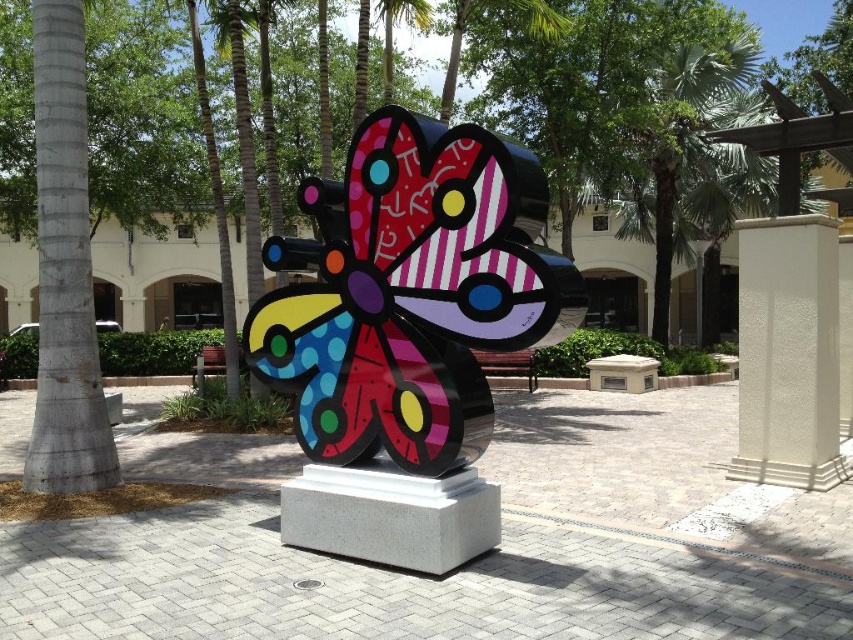
You are standing at the center of the plaza and want to place a small flower pot exactly at the point marked by the coordinates point (410, 292). Given that the metallic multicolored butterfly at center is the main sculpture here, where would this flower pot be placed relative to the sculpture?

The point (410, 292) is on the metallic multicolored butterfly at center, so placing the flower pot there would mean it is directly on the sculpture itself.

You are a maintenance worker checking the stability of the metallic multicolored butterfly at center and the smooth concrete pillar at left. According to the description, which object is positioned lower in the image?

The metallic multicolored butterfly at center is below the smooth concrete pillar at left, so it is positioned lower in the image.